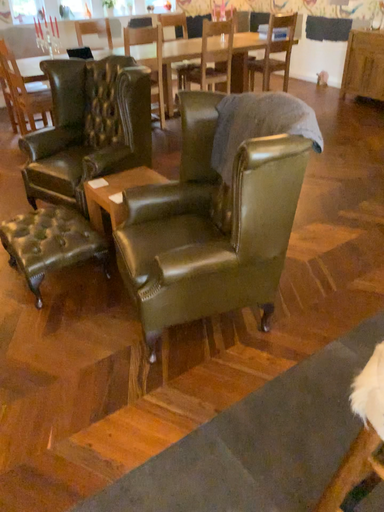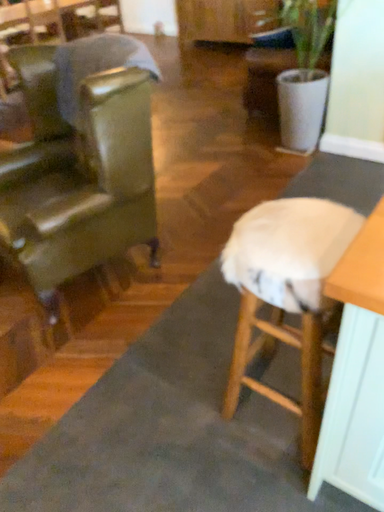
Question: How did the camera likely rotate when shooting the video?

Choices:
 (A) rotated left
 (B) rotated right

Answer: (B)